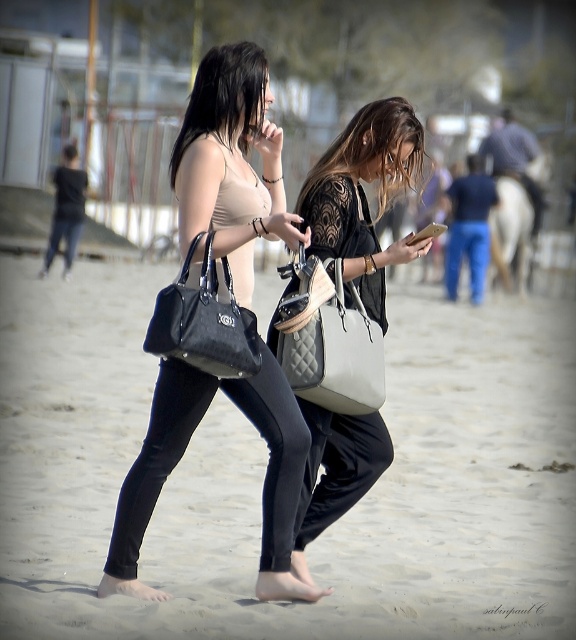
Can you confirm if matte black purse at center is positioned to the left of matte black tank top at upper center?

Incorrect, matte black purse at center is not on the left side of matte black tank top at upper center.

Does point (403, 102) lie in front of point (191, 138)?

No, it is not.

Is point (354, 488) less distant than point (188, 109)?

No, it is not.

Find the location of a particular element. The width and height of the screenshot is (576, 640). matte black purse at center is located at coordinates (363, 196).

Is black leather handbag at center-left closer to the viewer compared to matte black tank top at upper center?

Yes.

Between black leather handbag at center-left and matte black tank top at upper center, which one has more height?

With more height is matte black tank top at upper center.

Image resolution: width=576 pixels, height=640 pixels. What are the coordinates of `black leather handbag at center-left` in the screenshot? It's located at (204, 323).

Image resolution: width=576 pixels, height=640 pixels. Find the location of `black leather handbag at center-left`. black leather handbag at center-left is located at coordinates (204, 323).

Which is more to the right, black leather handbag at center-left or matte black phone at center?

Positioned to the right is matte black phone at center.

Does black leather handbag at center-left have a larger size compared to matte black phone at center?

No, black leather handbag at center-left is not bigger than matte black phone at center.

Is point (229, 356) closer to viewer compared to point (418, 241)?

That is True.

Locate an element on the screen. Image resolution: width=576 pixels, height=640 pixels. black leather handbag at center-left is located at coordinates (204, 323).